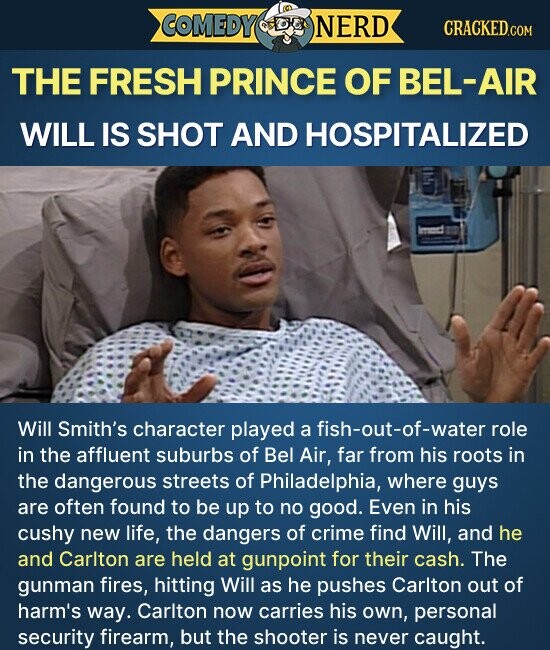
Where is `pillow`? pillow is located at coordinates (123, 244), (322, 236).